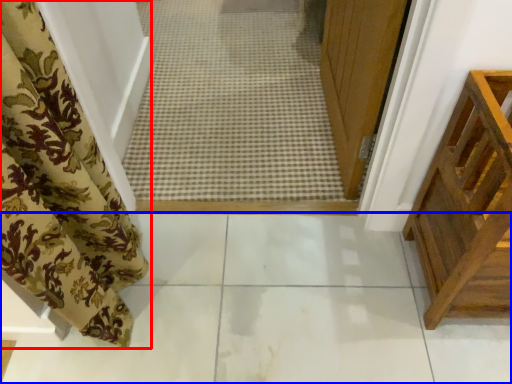
Question: Which point is further to the camera, curtain (highlighted by a red box) or path (highlighted by a blue box)?

Choices:
 (A) curtain
 (B) path

Answer: (B)